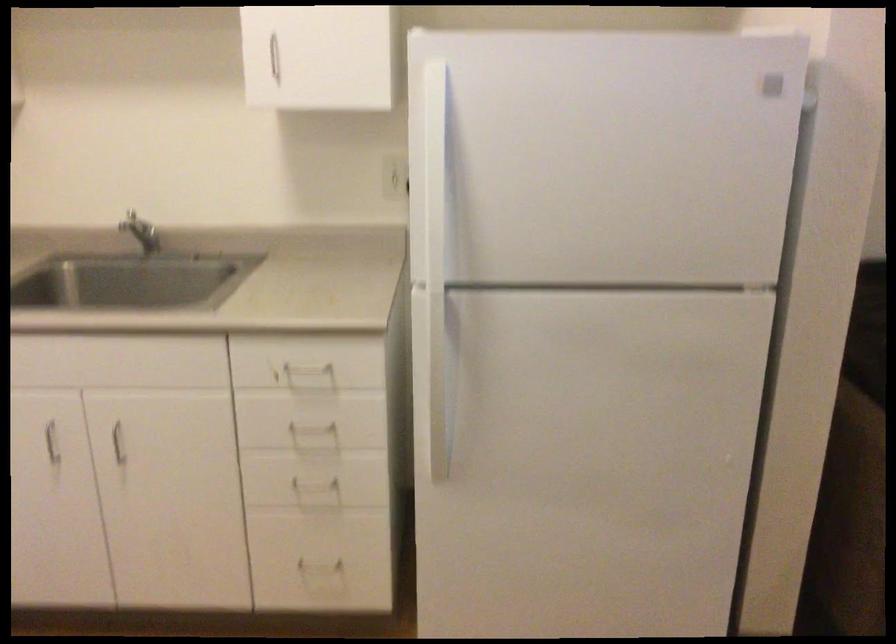
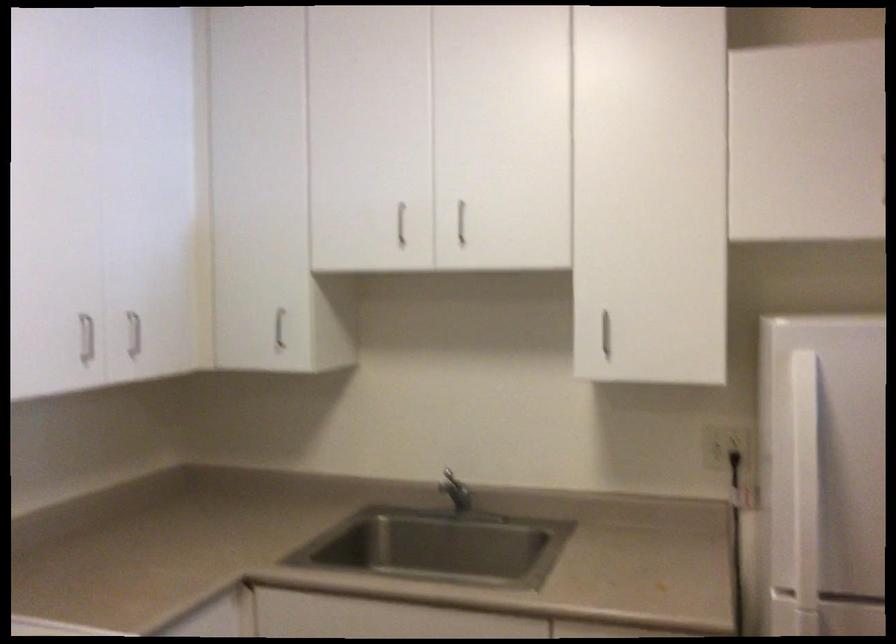
Question: The images are taken continuously from a first-person perspective. In which direction are you moving?

Choices:
 (A) Left
 (B) Right
 (C) Forward
 (D) Backward

Answer: (A)